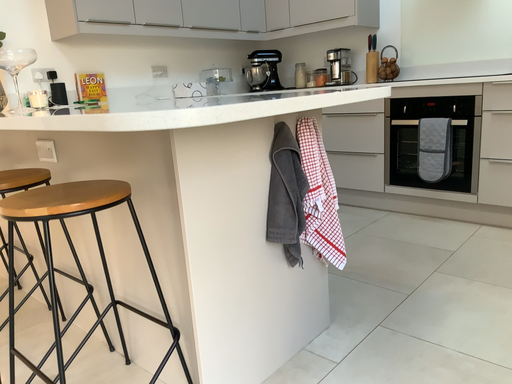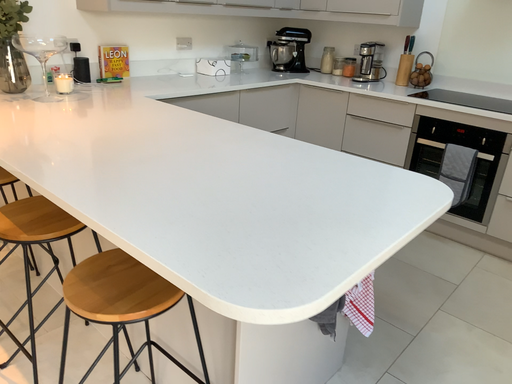
Question: How did the camera likely rotate when shooting the video?

Choices:
 (A) rotated downward
 (B) rotated upward

Answer: (A)